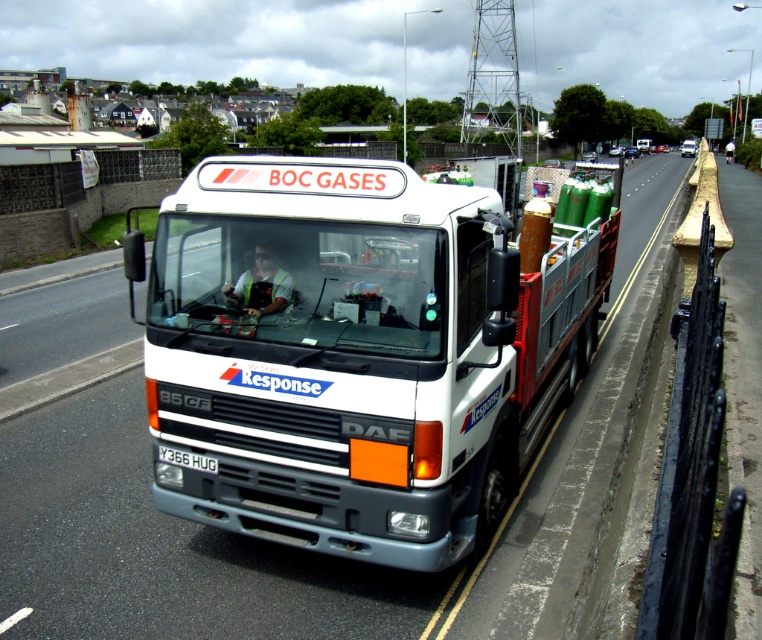
From the picture: You are a delivery driver who needs to enter a low clearance tunnel. The tunnel has a height limit of 2 meters. You are driving the white matte truck at center with a white plastic license plate at center. Can the truck pass through the tunnel without hitting the top?

The white matte truck at center is much taller than the white plastic license plate at center, but the exact height of the truck is not provided. Therefore, it is uncertain whether the truck can pass through the 2 meter height restriction without hitting the top.

You are a delivery driver who needs to park the white matte truck at center in a parking spot that can only accommodate vehicles up to the size of the white plastic license plate at center. Will the truck fit?

The white matte truck at center is larger in size than the white plastic license plate at center, so it will not fit in the parking spot designed for smaller vehicles.

You are a delivery driver for BOC Gases driving the DAF 85 CF truck. You need to navigate through a narrow section of the road where only one vehicle can pass at a time. There are two points marked on your GPS navigation system at coordinates point (335, 388) and point (159, 448). According to the image, which point should you aim for first to ensure safe passage through the narrow section?

Point (335, 388) should be aimed for first because it is in front of point (159, 448), ensuring you follow the correct path through the narrow section.